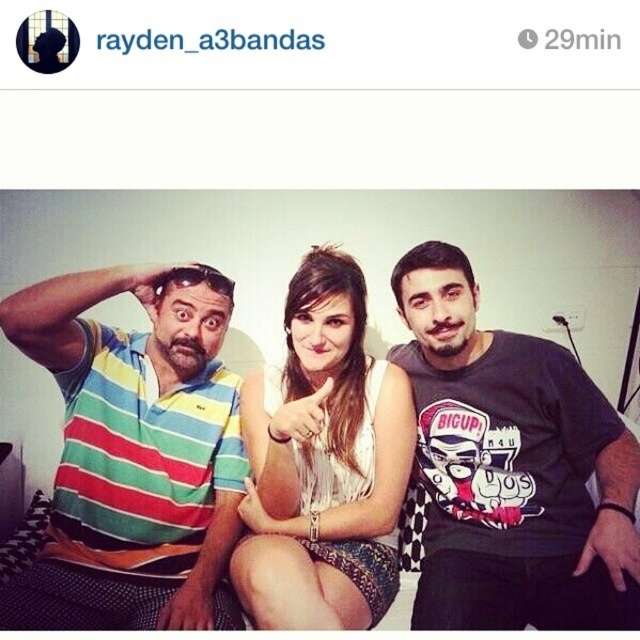
You are a photographer trying to capture a group photo. The striped polo shirt at left and the white textured dress at center are part of the scene. Based on their heights, which clothing item should you adjust first to ensure proper framing?

The striped polo shirt at left has a lesser height compared to the white textured dress at center, so you should adjust the white textured dress at center first to ensure proper framing since it is taller and might block the view of the shorter striped polo shirt at left.